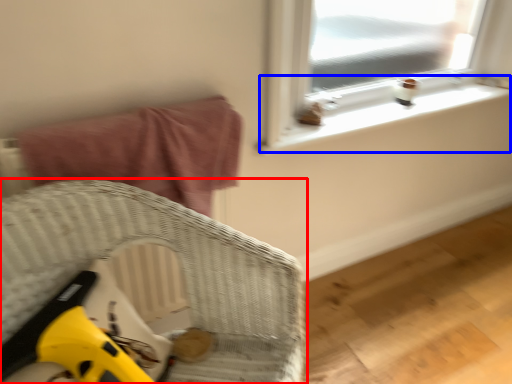
Question: Which of the following is the farthest to the observer, furniture (highlighted by a red box) or window sill (highlighted by a blue box)?

Choices:
 (A) furniture
 (B) window sill

Answer: (B)